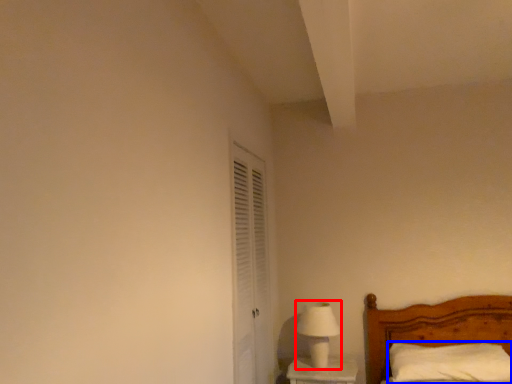
Question: Which of the following is the farthest to the observer, table lamp (highlighted by a red box) or pillow (highlighted by a blue box)?

Choices:
 (A) table lamp
 (B) pillow

Answer: (A)